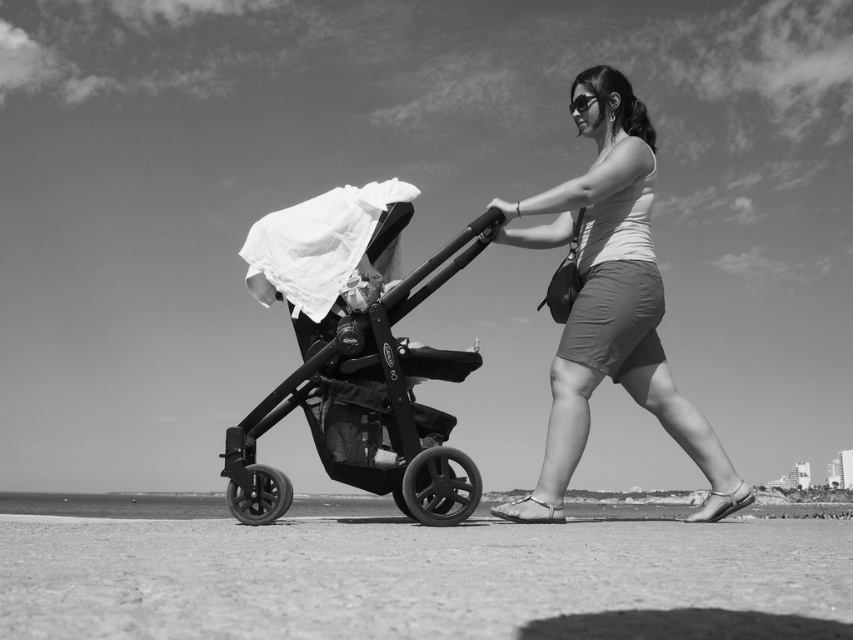
Question: Estimate the real-world distances between objects in this image. Which object is farther from the matte white tank top at center?

Choices:
 (A) matte black stroller at center
 (B) smooth sand at lower center
 (C) black matte baby carriage at center

Answer: (A)

Question: Which object is positioned farthest from the matte black stroller at center?

Choices:
 (A) matte white tank top at center
 (B) black matte baby carriage at center

Answer: (A)

Question: Observing the image, what is the correct spatial positioning of black matte baby carriage at center in reference to matte black stroller at center?

Choices:
 (A) above
 (B) below

Answer: (B)

Question: Where is smooth sand at lower center located in relation to matte white tank top at center in the image?

Choices:
 (A) above
 (B) below

Answer: (B)

Question: Can you confirm if smooth sand at lower center is wider than matte black stroller at center?

Choices:
 (A) no
 (B) yes

Answer: (B)

Question: Based on their relative distances, which object is nearer to the matte black stroller at center?

Choices:
 (A) black matte baby carriage at center
 (B) matte white tank top at center

Answer: (A)